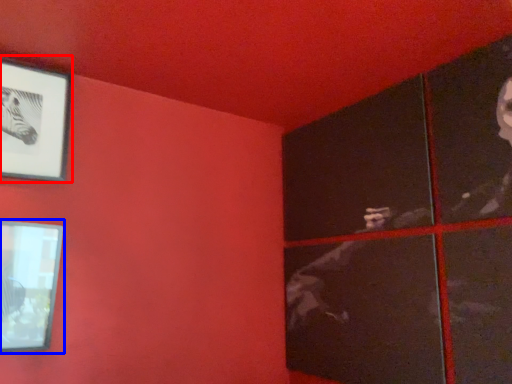
Question: Which object appears farthest to the camera in this image, picture frame (highlighted by a red box) or picture frame (highlighted by a blue box)?

Choices:
 (A) picture frame
 (B) picture frame

Answer: (A)